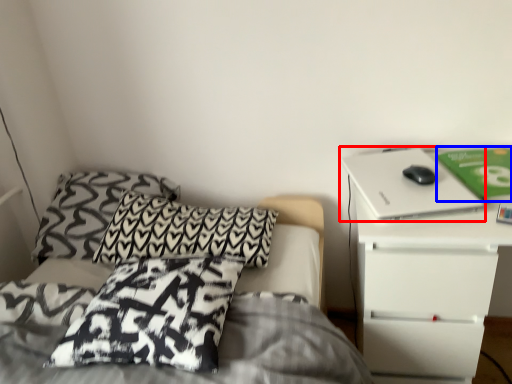
Question: Which object is closer to the camera taking this photo, computer (highlighted by a red box) or paperback book (highlighted by a blue box)?

Choices:
 (A) computer
 (B) paperback book

Answer: (A)